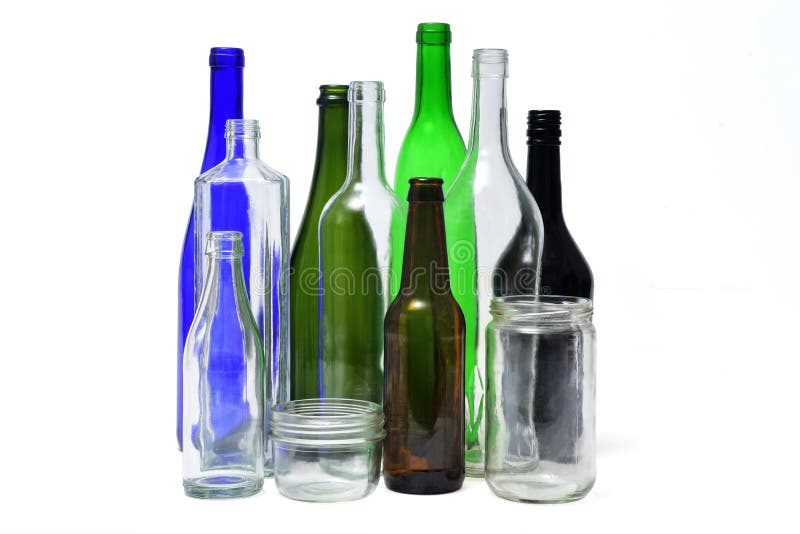
The image size is (800, 534). Identify the location of bottles. (225, 89), (241, 186), (218, 329), (332, 147), (362, 238), (429, 148), (420, 315), (489, 213), (558, 270).